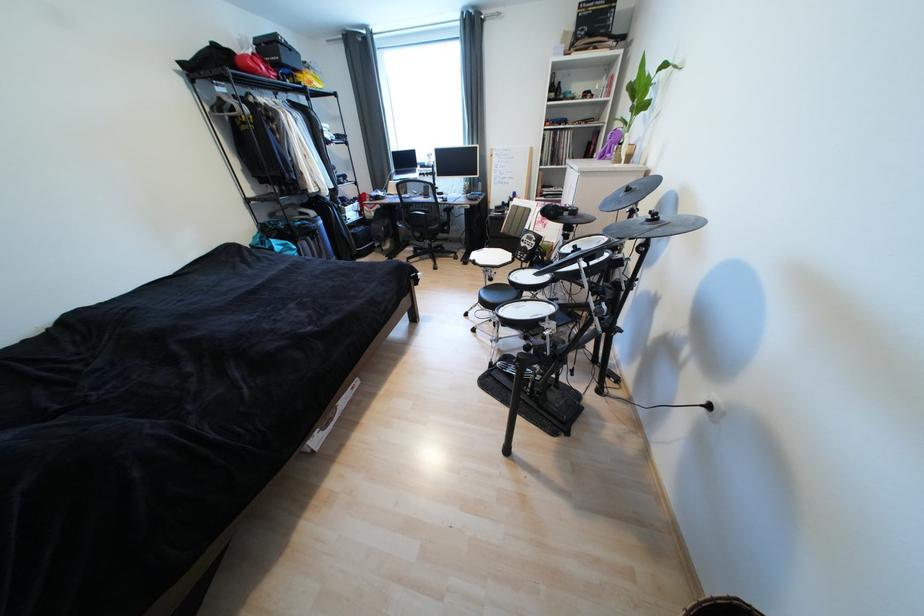
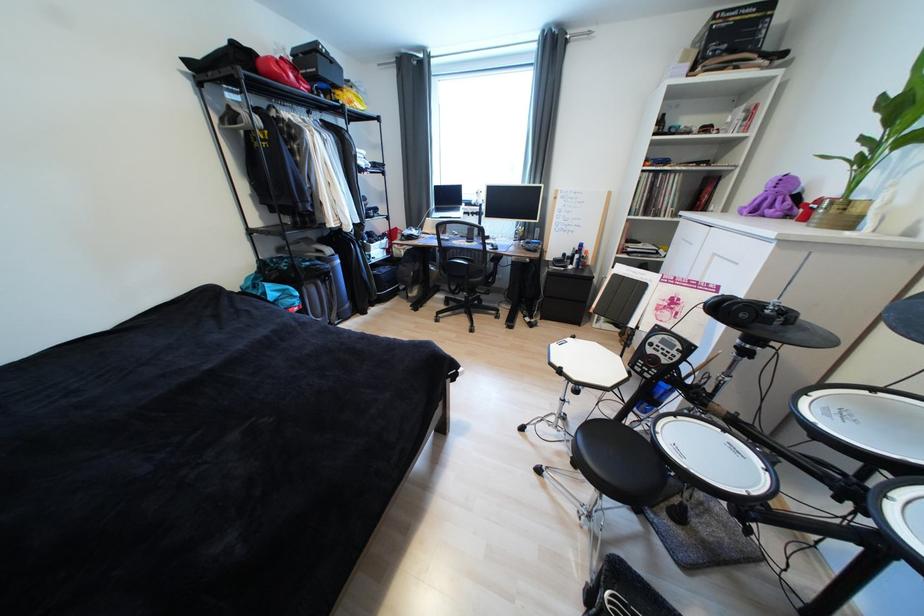
The images are taken continuously from a first-person perspective. In which direction are you moving?

The movement direction of the cameraman is left, forward.